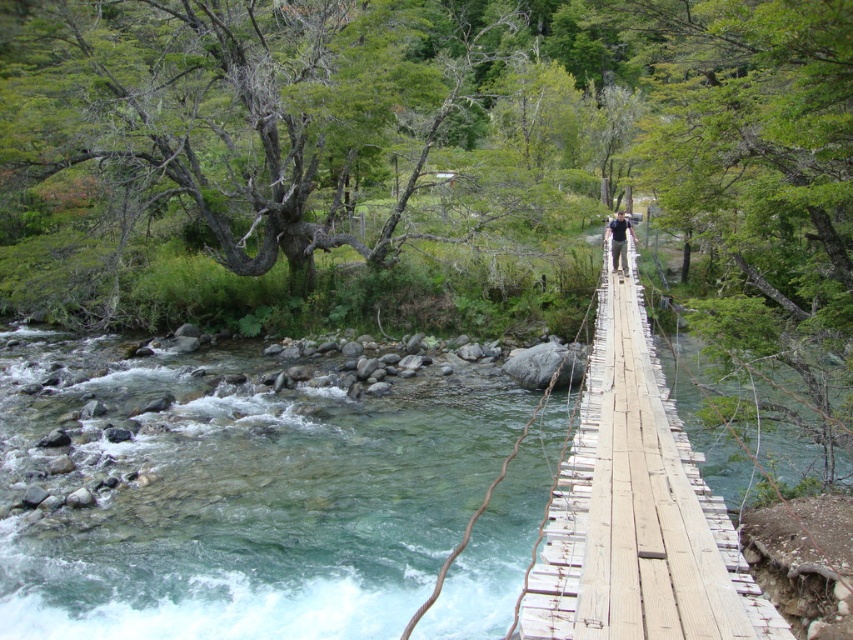
Looking at this image, does light brown wooden bridge at center have a lesser height compared to dark blue shirt at center?

Incorrect, light brown wooden bridge at center's height does not fall short of dark blue shirt at center's.

Between light brown wooden bridge at center and dark blue shirt at center, which one appears on the left side from the viewer's perspective?

light brown wooden bridge at center is more to the left.

The image size is (853, 640). What do you see at coordinates (637, 509) in the screenshot?
I see `light brown wooden bridge at center` at bounding box center [637, 509].

Where is `light brown wooden bridge at center`? light brown wooden bridge at center is located at coordinates (637, 509).